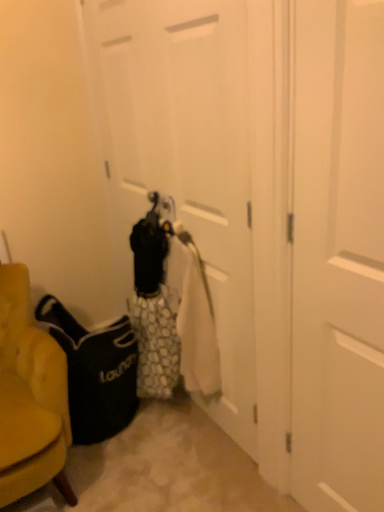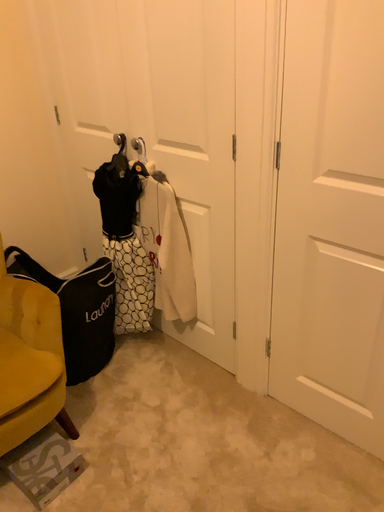
Question: How did the camera likely rotate when shooting the video?

Choices:
 (A) rotated right
 (B) rotated left

Answer: (A)